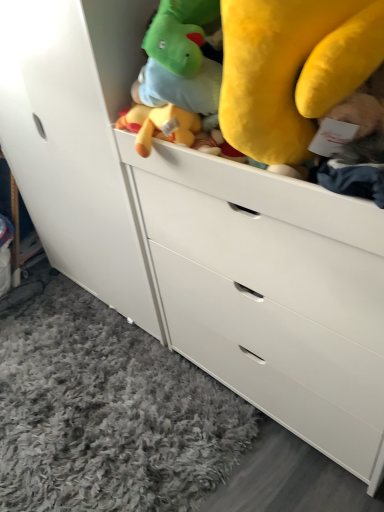
Question: Is white matte cabinet at upper center far from gray shag rug at lower left?

Choices:
 (A) yes
 (B) no

Answer: (B)

Question: Can you confirm if white matte cabinet at upper center is positioned to the right of gray shag rug at lower left?

Choices:
 (A) no
 (B) yes

Answer: (B)

Question: Is white matte cabinet at upper center smaller than gray shag rug at lower left?

Choices:
 (A) no
 (B) yes

Answer: (A)

Question: Is the position of white matte cabinet at upper center more distant than that of gray shag rug at lower left?

Choices:
 (A) no
 (B) yes

Answer: (A)

Question: From the image's perspective, would you say white matte cabinet at upper center is shown under gray shag rug at lower left?

Choices:
 (A) yes
 (B) no

Answer: (B)

Question: From a real-world perspective, is white matte cabinet at upper center physically below gray shag rug at lower left?

Choices:
 (A) yes
 (B) no

Answer: (B)

Question: From the image's perspective, is gray shag rug at lower left over white matte cabinet at upper center?

Choices:
 (A) yes
 (B) no

Answer: (B)

Question: Considering the relative sizes of gray shag rug at lower left and white matte cabinet at upper center in the image provided, is gray shag rug at lower left wider than white matte cabinet at upper center?

Choices:
 (A) yes
 (B) no

Answer: (A)

Question: Is gray shag rug at lower left at the right side of white matte cabinet at upper center?

Choices:
 (A) no
 (B) yes

Answer: (A)

Question: From a real-world perspective, is gray shag rug at lower left beneath white matte cabinet at upper center?

Choices:
 (A) yes
 (B) no

Answer: (A)

Question: Is the depth of gray shag rug at lower left less than that of white matte cabinet at upper center?

Choices:
 (A) yes
 (B) no

Answer: (B)

Question: Does gray shag rug at lower left appear on the left side of white matte cabinet at upper center?

Choices:
 (A) no
 (B) yes

Answer: (B)

Question: Considering the positions of white matte cabinet at upper center and gray shag rug at lower left in the image, is white matte cabinet at upper center taller or shorter than gray shag rug at lower left?

Choices:
 (A) short
 (B) tall

Answer: (B)